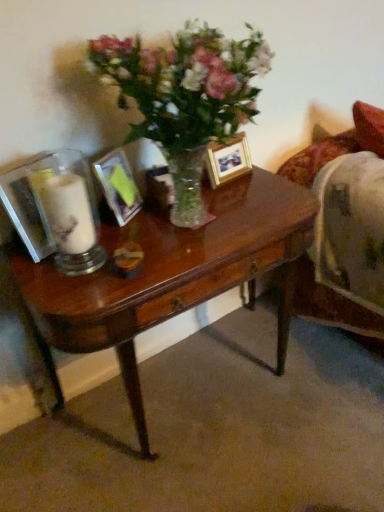
Locate an element on the screen. The image size is (384, 512). vacant area in front of wooden photo frame at center, which is the second picture frame in left-to-right order is located at coordinates (230, 199).